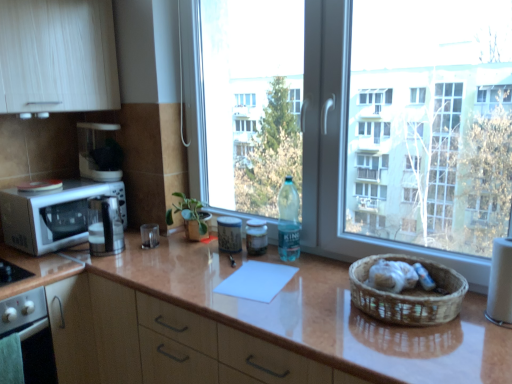
Question: Can you confirm if white paper towel at right, the 4th appliance viewed from the back, is bigger than satin silver coffee machine at center?

Choices:
 (A) no
 (B) yes

Answer: (A)

Question: Considering the relative sizes of white paper towel at right, arranged as the 1th appliance when viewed from the front, and satin silver coffee machine at center in the image provided, is white paper towel at right, arranged as the 1th appliance when viewed from the front, shorter than satin silver coffee machine at center?

Choices:
 (A) no
 (B) yes

Answer: (B)

Question: Is there a large distance between white paper towel at right, which ranks as the 1th appliance in bottom-to-top order, and satin silver coffee machine at center?

Choices:
 (A) no
 (B) yes

Answer: (B)

Question: Can you confirm if white paper towel at right, which appears as the first appliance when viewed from the right, is wider than satin silver coffee machine at center?

Choices:
 (A) yes
 (B) no

Answer: (B)

Question: Is white paper towel at right, the fourth appliance when ordered from top to bottom, thinner than satin silver coffee machine at center?

Choices:
 (A) no
 (B) yes

Answer: (B)

Question: Is point (76, 380) closer or farther from the camera than point (108, 140)?

Choices:
 (A) closer
 (B) farther

Answer: (A)

Question: From the image's perspective, is glossy brown countertop at center positioned above or below matte white coffee maker at upper left, the first appliance positioned from the left?

Choices:
 (A) below
 (B) above

Answer: (A)

Question: From a real-world perspective, is glossy brown countertop at center above or below matte white coffee maker at upper left, the 4th appliance in the front-to-back sequence?

Choices:
 (A) below
 (B) above

Answer: (A)

Question: Based on their positions, is glossy brown countertop at center located to the left or right of matte white coffee maker at upper left, the 4th appliance in the front-to-back sequence?

Choices:
 (A) left
 (B) right

Answer: (B)

Question: Would you say matte white coffee maker at upper left, the first appliance positioned from the left, is to the left or to the right of white glossy oven at lower left in the picture?

Choices:
 (A) left
 (B) right

Answer: (B)

Question: Do you think matte white coffee maker at upper left, the 4th appliance in the front-to-back sequence, is within white glossy oven at lower left, or outside of it?

Choices:
 (A) inside
 (B) outside

Answer: (B)

Question: Is matte white coffee maker at upper left, the 4th appliance in the front-to-back sequence, wider or thinner than white glossy oven at lower left?

Choices:
 (A) wide
 (B) thin

Answer: (B)

Question: From their relative heights in the image, would you say matte white coffee maker at upper left, the 4th appliance in the front-to-back sequence, is taller or shorter than white glossy oven at lower left?

Choices:
 (A) short
 (B) tall

Answer: (A)

Question: In terms of width, does brown woven basket at right look wider or thinner when compared to matte glass jar at center, which ranks as the 3th appliance in right-to-left order?

Choices:
 (A) thin
 (B) wide

Answer: (B)

Question: Would you say brown woven basket at right is to the left or to the right of matte glass jar at center, the 3th appliance positioned from the bottom, in the picture?

Choices:
 (A) right
 (B) left

Answer: (A)